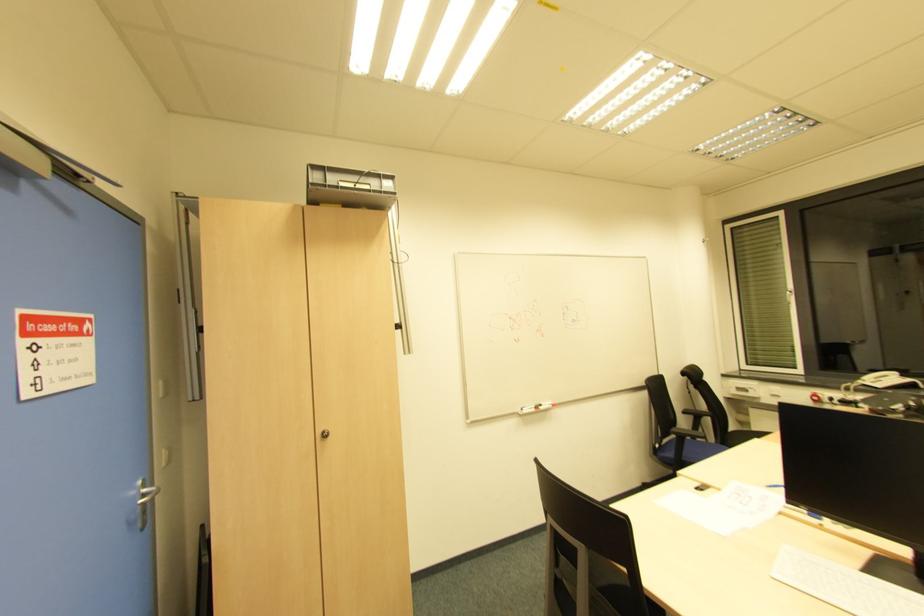
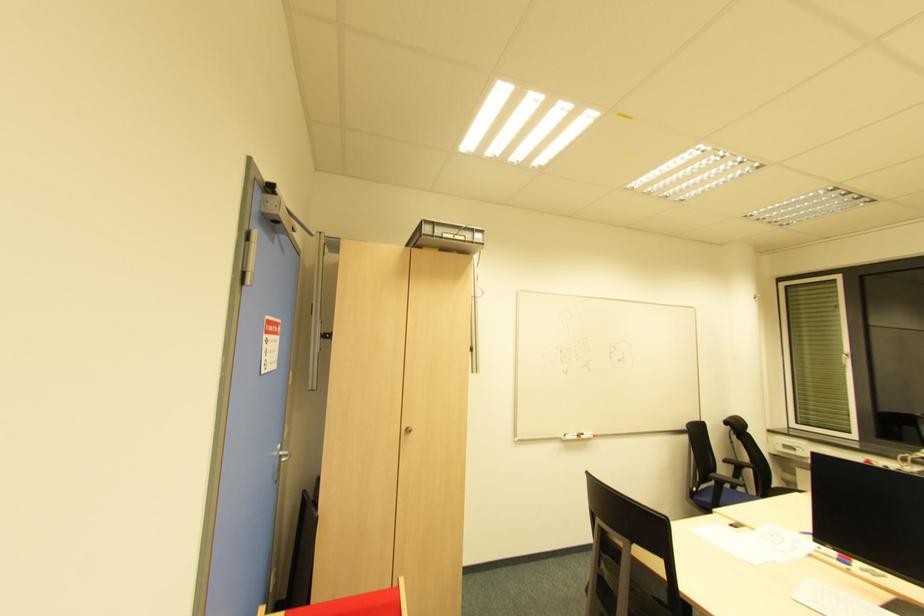
What movement of the cameraman would produce the second image?

The cameraman walked toward left, backward.